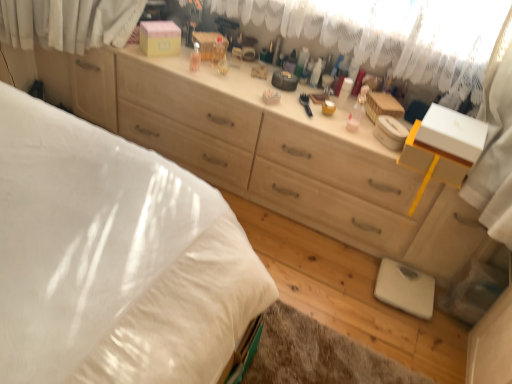
Question: From a real-world perspective, is white plastic container at center, arranged as the 2th toiletry when viewed from the right, beneath matte plastic container at center, placed as the first toiletry when sorted from right to left?

Choices:
 (A) no
 (B) yes

Answer: (B)

Question: Can you confirm if white plastic container at center, placed as the 2th toiletry when sorted from left to right, is smaller than matte plastic container at center, the 3th toiletry when ordered from left to right?

Choices:
 (A) no
 (B) yes

Answer: (B)

Question: From the image's perspective, would you say white plastic container at center, placed as the 2th toiletry when sorted from left to right, is positioned over matte plastic container at center, placed as the first toiletry when sorted from right to left?

Choices:
 (A) no
 (B) yes

Answer: (B)

Question: From the image's perspective, is white plastic container at center, arranged as the 2th toiletry when viewed from the right, beneath matte plastic container at center, placed as the first toiletry when sorted from right to left?

Choices:
 (A) yes
 (B) no

Answer: (B)

Question: Is white plastic container at center, arranged as the 2th toiletry when viewed from the right, at the right side of matte plastic container at center, the 3th toiletry when ordered from left to right?

Choices:
 (A) yes
 (B) no

Answer: (B)

Question: Looking at the image, does white soft bed at lower left seem bigger or smaller compared to transparent plastic bottle at center, which is counted as the 1th toiletry, starting from the left?

Choices:
 (A) big
 (B) small

Answer: (A)

Question: Choose the correct answer: Is white soft bed at lower left inside transparent plastic bottle at center, which is counted as the 1th toiletry, starting from the left, or outside it?

Choices:
 (A) outside
 (B) inside

Answer: (A)

Question: From the image's perspective, is white soft bed at lower left located above or below transparent plastic bottle at center, arranged as the 3th toiletry when viewed from the right?

Choices:
 (A) below
 (B) above

Answer: (A)

Question: Considering the positions of point (70, 370) and point (188, 67), is point (70, 370) closer or farther from the camera than point (188, 67)?

Choices:
 (A) farther
 (B) closer

Answer: (B)

Question: Would you say matte plastic container at center, the 3th toiletry when ordered from left to right, is inside or outside white plastic container at center, placed as the 2th toiletry when sorted from left to right?

Choices:
 (A) inside
 (B) outside

Answer: (B)

Question: In terms of size, does matte plastic container at center, placed as the first toiletry when sorted from right to left, appear bigger or smaller than white plastic container at center, arranged as the 2th toiletry when viewed from the right?

Choices:
 (A) small
 (B) big

Answer: (B)

Question: From a real-world perspective, is matte plastic container at center, the 3th toiletry when ordered from left to right, above or below white plastic container at center, arranged as the 2th toiletry when viewed from the right?

Choices:
 (A) below
 (B) above

Answer: (B)

Question: In terms of width, does matte plastic container at center, the 3th toiletry when ordered from left to right, look wider or thinner when compared to white plastic container at center, placed as the 2th toiletry when sorted from left to right?

Choices:
 (A) thin
 (B) wide

Answer: (B)

Question: In terms of width, does matte plastic container at center, the 3th toiletry when ordered from left to right, look wider or thinner when compared to transparent plastic bottle at center, arranged as the 3th toiletry when viewed from the right?

Choices:
 (A) thin
 (B) wide

Answer: (A)

Question: From their relative heights in the image, would you say matte plastic container at center, placed as the first toiletry when sorted from right to left, is taller or shorter than transparent plastic bottle at center, arranged as the 3th toiletry when viewed from the right?

Choices:
 (A) short
 (B) tall

Answer: (B)